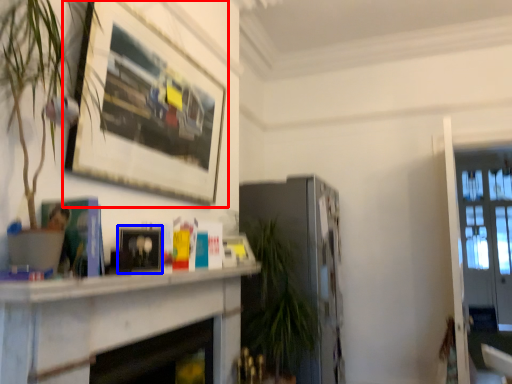
Question: Which object is further to the camera taking this photo, picture frame (highlighted by a red box) or picture frame (highlighted by a blue box)?

Choices:
 (A) picture frame
 (B) picture frame

Answer: (B)